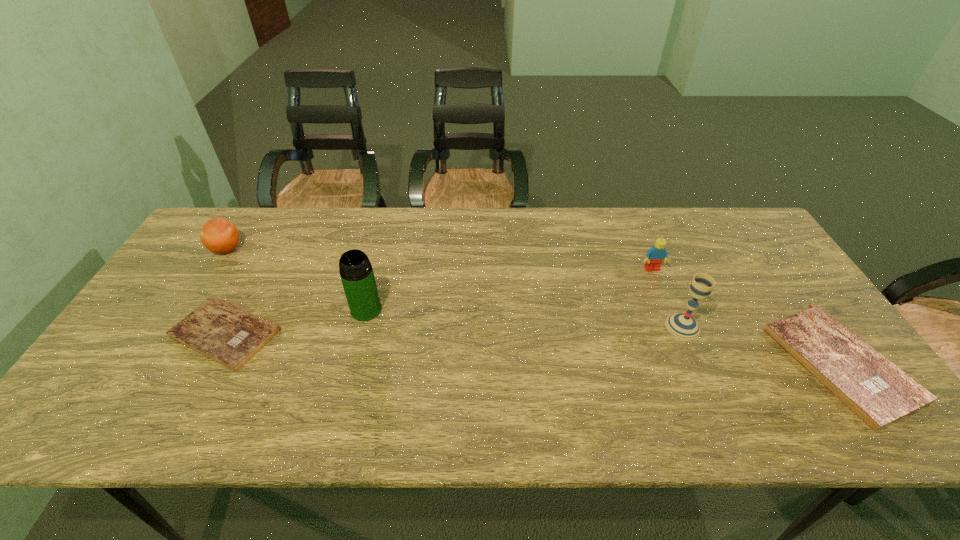
The width and height of the screenshot is (960, 540). What are the coordinates of `object positioned at the near left corner` in the screenshot? It's located at (227, 334).

Locate an element on the screen. Image resolution: width=960 pixels, height=540 pixels. object at the near right corner is located at coordinates (878, 392).

Image resolution: width=960 pixels, height=540 pixels. What are the coordinates of `vacant space at the far edge of the desktop` in the screenshot? It's located at (385, 234).

In the image, there is a desktop. What are the coordinates of `vacant space at the near edge` in the screenshot? It's located at (647, 380).

The height and width of the screenshot is (540, 960). What are the coordinates of `free region at the left edge of the desktop` in the screenshot? It's located at (177, 269).

In the image, there is a desktop. What are the coordinates of `free region at the right edge` in the screenshot? It's located at (752, 276).

At what (x,y) coordinates should I click in order to perform the action: click on free space at the far left corner of the desktop. Please return your answer as a coordinate pair (x, y). Image resolution: width=960 pixels, height=540 pixels. Looking at the image, I should click on (247, 214).

Image resolution: width=960 pixels, height=540 pixels. Find the location of `vacant space at the far right corner`. vacant space at the far right corner is located at coordinates (752, 234).

What are the coordinates of `unoccupied area between the shorter Bible and the fifth shortest object` in the screenshot? It's located at (454, 330).

Locate an element on the screen. This screenshot has height=540, width=960. unoccupied position between the chalice and the orange is located at coordinates (455, 288).